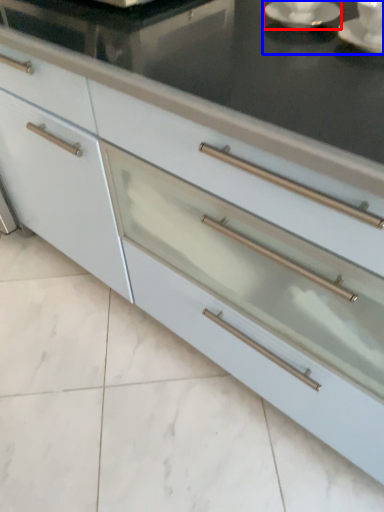
Question: Which point is closer to the camera, saucer (highlighted by a red box) or tea set (highlighted by a blue box)?

Choices:
 (A) saucer
 (B) tea set

Answer: (A)